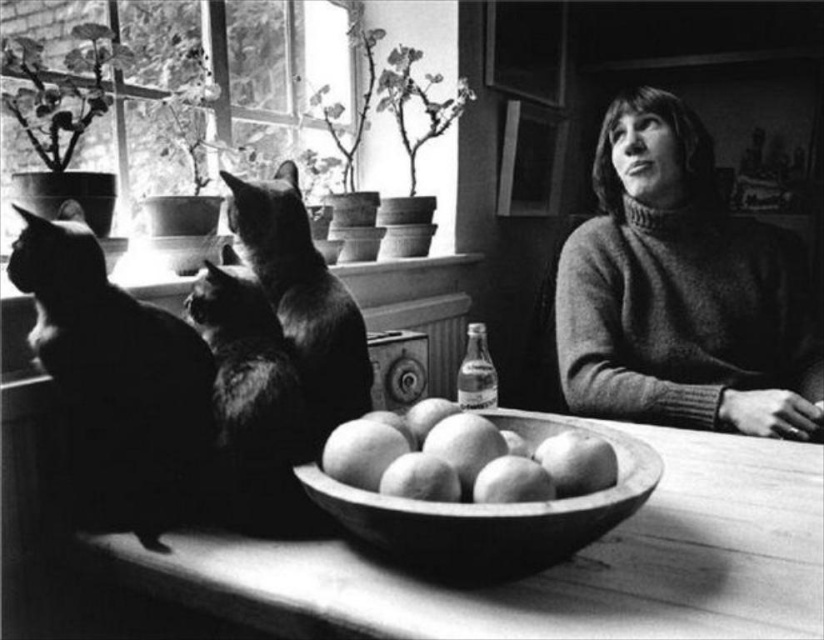
Describe the element at coordinates (680, 291) in the screenshot. I see `knitted sweater at right` at that location.

Who is positioned more to the right, knitted sweater at right or smooth wooden bowl at center?

knitted sweater at right

From the picture: Who is more forward, (645,252) or (602,472)?

Positioned in front is point (602,472).

This screenshot has width=824, height=640. In order to click on knitted sweater at right in this screenshot , I will do (x=680, y=291).

Is wooden bowl of apples at center wider than smooth wooden bowl at center?

Yes, wooden bowl of apples at center is wider than smooth wooden bowl at center.

Is wooden bowl of apples at center thinner than smooth wooden bowl at center?

In fact, wooden bowl of apples at center might be wider than smooth wooden bowl at center.

Describe the element at coordinates (532, 554) in the screenshot. Image resolution: width=824 pixels, height=640 pixels. I see `wooden bowl of apples at center` at that location.

Where is `wooden bowl of apples at center`? The width and height of the screenshot is (824, 640). wooden bowl of apples at center is located at coordinates (532, 554).

Between point (143, 419) and point (550, 563), which one is positioned behind?

Point (143, 419)

Does point (186, 378) lie in front of point (466, 520)?

No, (186, 378) is further to viewer.

Find the location of a particular element. This screenshot has height=640, width=824. silhouette fur cat at left is located at coordinates (119, 372).